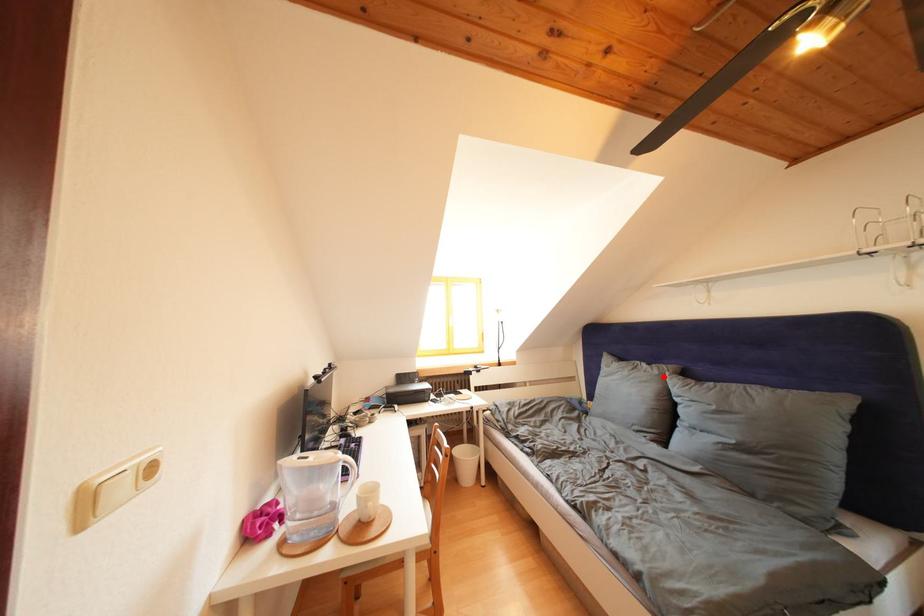
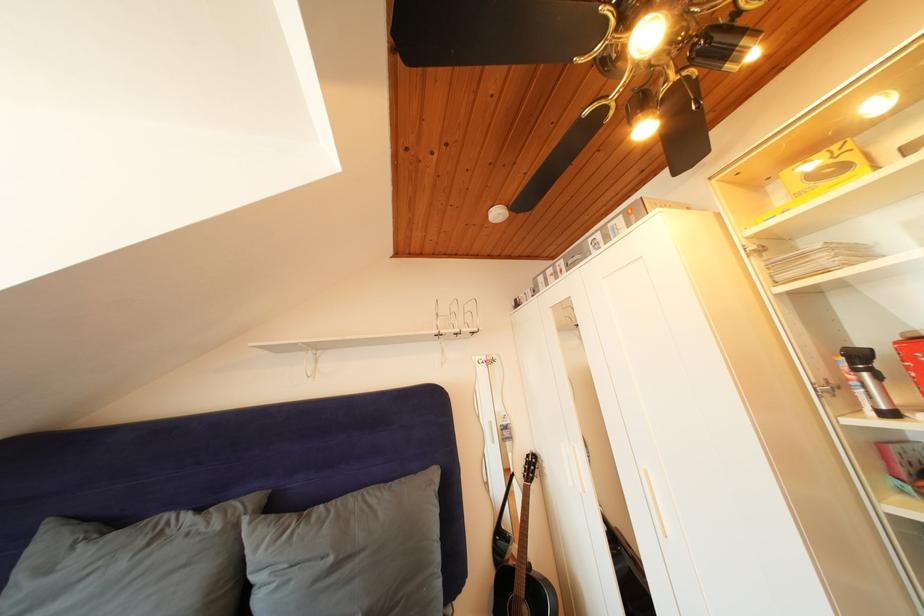
Find the pixel in the second image that matches the highlighted location in the first image.

(225, 531)